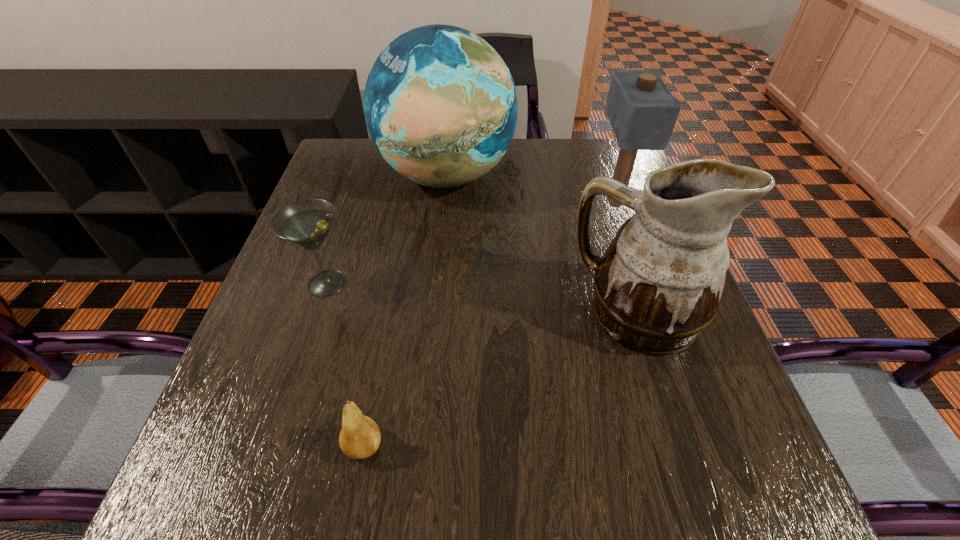
Identify the location of object that is at the far left corner. This screenshot has width=960, height=540. coord(440,104).

You are a GUI agent. You are given a task and a screenshot of the screen. Output one action in this format:
    pyautogui.click(x=<x>, y=<y>)
    Task: Click on the object located in the far right corner section of the desktop
    The image size is (960, 540).
    Given the screenshot: What is the action you would take?
    pyautogui.click(x=642, y=111)

This screenshot has height=540, width=960. In the image, there is a desktop. Identify the location of free region at the far edge. [567, 142].

The height and width of the screenshot is (540, 960). In the image, there is a desktop. What are the coordinates of `free region at the near edge` in the screenshot? It's located at (541, 522).

In the image, there is a desktop. Where is `free region at the left edge`? This screenshot has height=540, width=960. free region at the left edge is located at coordinates (315, 301).

Find the location of a particular element. The height and width of the screenshot is (540, 960). free space at the far left corner of the desktop is located at coordinates (332, 154).

Where is `free spot between the mallet and the nearest object`? free spot between the mallet and the nearest object is located at coordinates (490, 324).

Where is `vacant area that lies between the pear and the martini`? vacant area that lies between the pear and the martini is located at coordinates (346, 364).

This screenshot has width=960, height=540. Find the location of `free spot between the mallet and the pear`. free spot between the mallet and the pear is located at coordinates (490, 324).

You are a GUI agent. You are given a task and a screenshot of the screen. Output one action in this format:
    pyautogui.click(x=<x>, y=<y>)
    Task: Click on the unoccupied area between the nearest object and the second shortest object
    The width and height of the screenshot is (960, 540).
    Given the screenshot: What is the action you would take?
    pyautogui.click(x=346, y=364)